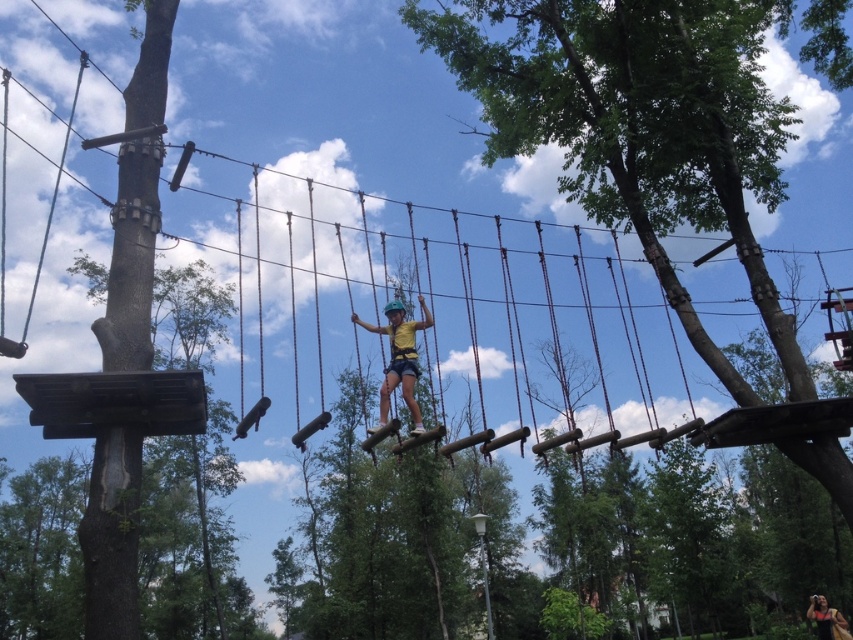
You are standing at the center of the high ropes course and want to reach the brown wood pole at left. Which direction should you move to get there?

You should move to the left to reach the brown wood pole at left.

You are an adventure guide assessing the safety of the ropes course setup. You notice the yellow fabric harness at center and the matte yellow shirt at center. Which object is positioned higher in the image?

The yellow fabric harness at center is much taller than the matte yellow shirt at center, so it is positioned higher in the image.

You are a safety inspector checking the ropes course setup. You notice the green wood tree at upper center and the brown wood pole at left. Which object is positioned to the right side of the other?

The green wood tree at upper center is positioned to the right of the brown wood pole at left.